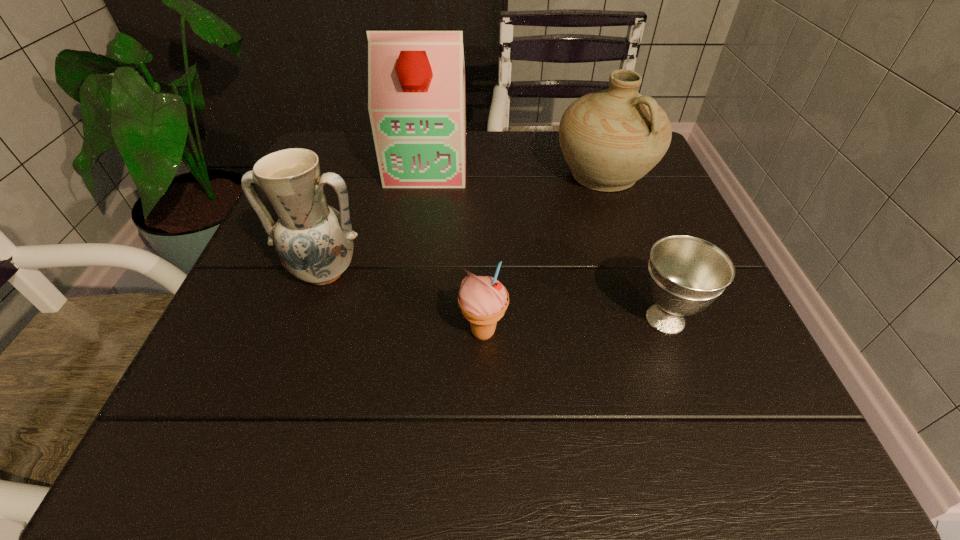
Where is `soya milk`? The width and height of the screenshot is (960, 540). soya milk is located at coordinates (416, 77).

Identify the location of the right pottery. (610, 139).

Find the location of `the nearer pottery`. the nearer pottery is located at coordinates (314, 241).

The height and width of the screenshot is (540, 960). I want to click on the third object from right to left, so click(x=483, y=300).

At what (x,y) coordinates should I click in order to perform the action: click on chalice. Please return your answer as a coordinate pair (x, y). The height and width of the screenshot is (540, 960). Looking at the image, I should click on (686, 274).

Find the location of `vacant space located with the cap open on the soya milk`. vacant space located with the cap open on the soya milk is located at coordinates (406, 303).

I want to click on free spot located 0.130m on the front of the farther pottery, so click(630, 247).

Image resolution: width=960 pixels, height=540 pixels. I want to click on vacant area situated on either side of the left pottery, so click(x=304, y=331).

Where is `vacant space situated on the back of the third object from left to right`? This screenshot has width=960, height=540. vacant space situated on the back of the third object from left to right is located at coordinates (482, 197).

The image size is (960, 540). What are the coordinates of `free space located on the left of the chalice` in the screenshot? It's located at (493, 319).